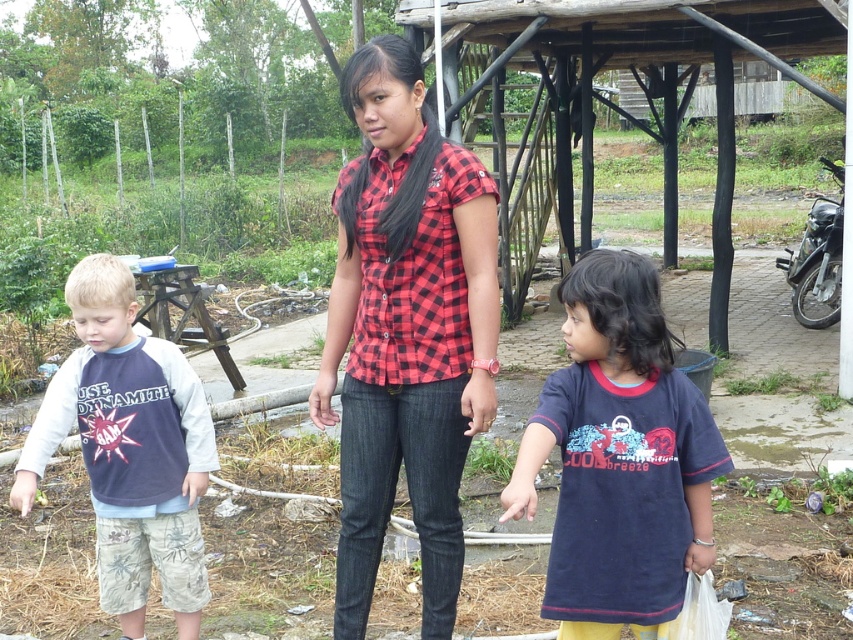
Which is more to the left, red checkered shirt at center or dark blue jersey at left?

dark blue jersey at left

Which is in front, point (456, 170) or point (154, 381)?

Positioned in front is point (456, 170).

Who is more forward, (x=466, y=424) or (x=131, y=404)?

Point (x=466, y=424) is in front.

You are a GUI agent. You are given a task and a screenshot of the screen. Output one action in this format:
    pyautogui.click(x=<x>, y=<y>)
    Task: Click on the red checkered shirt at center
    
    Given the screenshot: What is the action you would take?
    pyautogui.click(x=405, y=332)

From the picture: Does dark blue t-shirt at center have a smaller size compared to dark blue jersey at left?

Yes, dark blue t-shirt at center is smaller than dark blue jersey at left.

Who is more distant from viewer, [546,596] or [108,353]?

Point [108,353]

Find the location of a particular element. dark blue t-shirt at center is located at coordinates coord(619,458).

Can you confirm if red checkered shirt at center is shorter than dark blue t-shirt at center?

No.

What do you see at coordinates (405, 332) in the screenshot?
I see `red checkered shirt at center` at bounding box center [405, 332].

Which is in front, point (386, 499) or point (553, 378)?

Positioned in front is point (553, 378).

Where is `red checkered shirt at center`? The height and width of the screenshot is (640, 853). red checkered shirt at center is located at coordinates (405, 332).